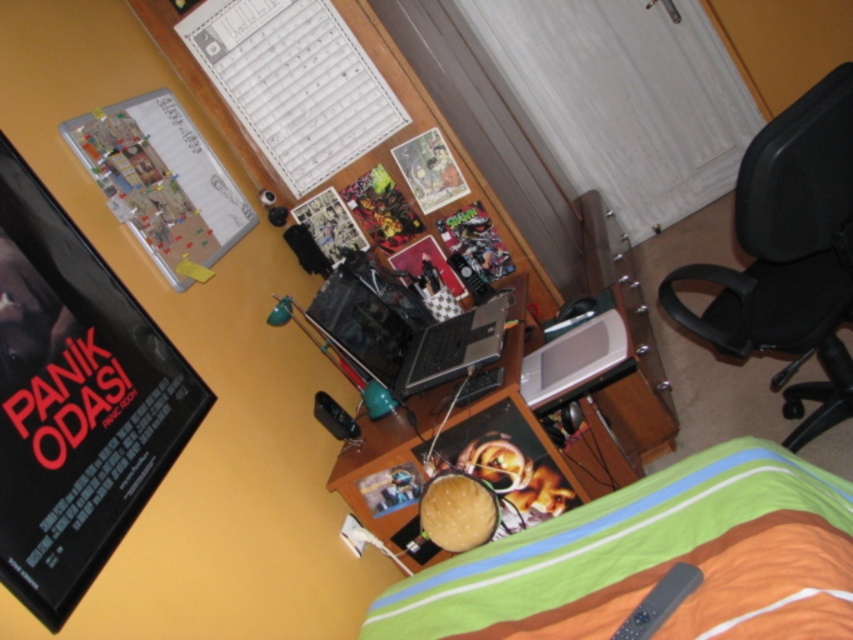
You are a person who is 1.8 meters tall. You are sitting on the black plastic swivel chair at right and want to reach the shiny black laptop at center on the desk. Considering the height difference between the chair and the laptop, will your arms comfortably reach the laptop without straining?

The black plastic swivel chair at right has a greater height compared to shiny black laptop at center. Since the chair is taller, your arms might need to stretch downward to reach the laptop, which could cause some strain depending on your posture. It might be more comfortable to lower the chair or raise the laptop to reduce the height difference.

You are a person sitting in the black plastic swivel chair at right and want to reach the metallic silver laptop at center. Can you comfortably reach it without moving your chair?

The black plastic swivel chair at right is 60.44 centimeters from the metallic silver laptop at center. Since the distance is over 60 cm, it might be a bit far to comfortably reach without moving the chair.